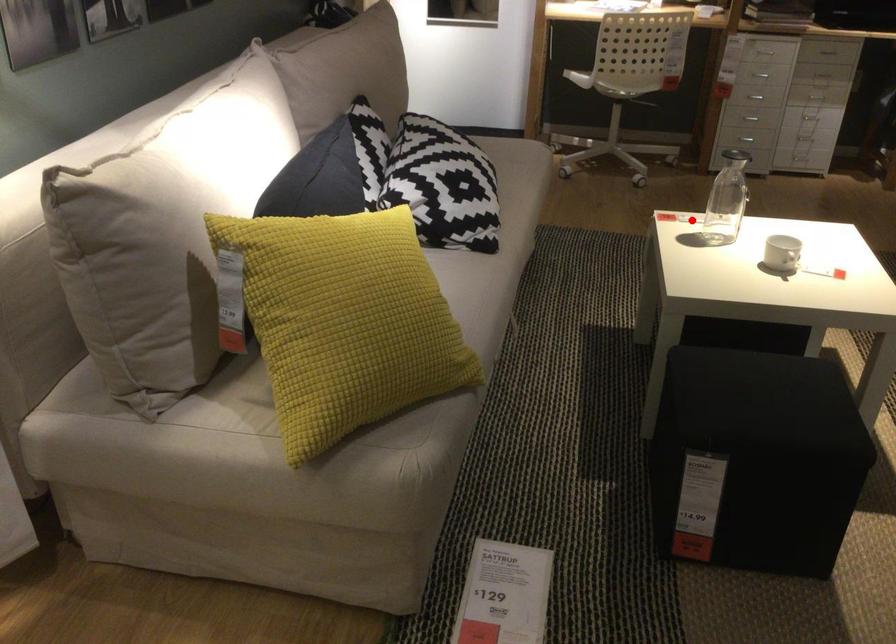
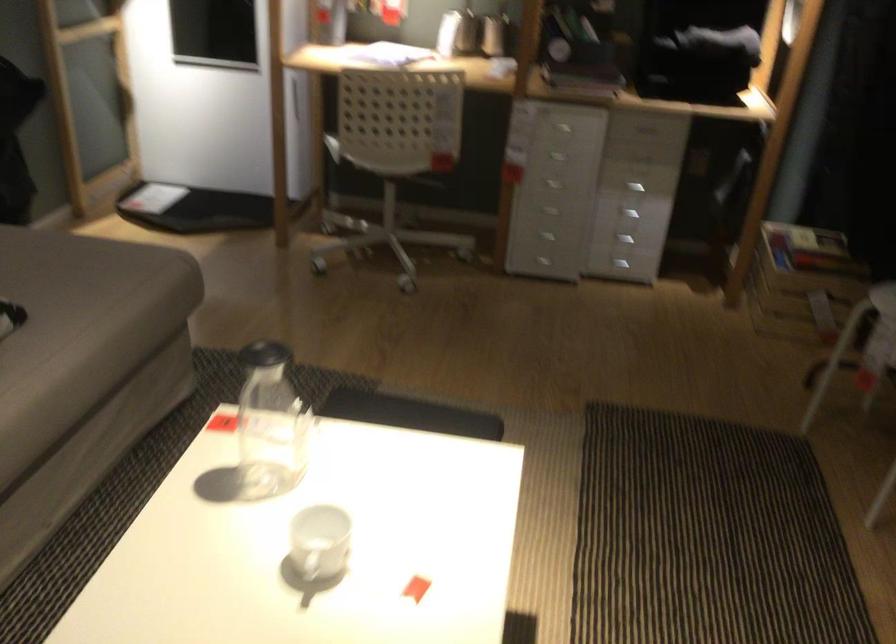
Question: I am providing you with two images of the same scene from different viewpoints. A red point is marked on the first image. At the location where the point appears in image 1, is it still visible in image 2?

Choices:
 (A) Yes
 (B) No

Answer: (A)